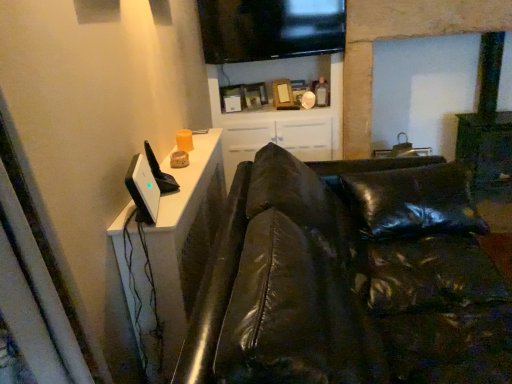
Question: From a real-world perspective, is flat screen tv at upper center physically above white glossy cabinet at upper center?

Choices:
 (A) no
 (B) yes

Answer: (B)

Question: Is flat screen tv at upper center at the left side of white glossy cabinet at upper center?

Choices:
 (A) no
 (B) yes

Answer: (B)

Question: Considering the relative sizes of flat screen tv at upper center and white glossy cabinet at upper center in the image provided, is flat screen tv at upper center thinner than white glossy cabinet at upper center?

Choices:
 (A) no
 (B) yes

Answer: (B)

Question: Is flat screen tv at upper center further to the viewer compared to white glossy cabinet at upper center?

Choices:
 (A) no
 (B) yes

Answer: (A)

Question: Considering the relative sizes of flat screen tv at upper center and white glossy cabinet at upper center in the image provided, is flat screen tv at upper center wider than white glossy cabinet at upper center?

Choices:
 (A) no
 (B) yes

Answer: (A)

Question: Is white glossy cabinet at upper center surrounded by flat screen tv at upper center?

Choices:
 (A) yes
 (B) no

Answer: (B)

Question: From a real-world perspective, is flat screen tv at upper center over black leather couch at left?

Choices:
 (A) yes
 (B) no

Answer: (A)

Question: Considering the relative sizes of flat screen tv at upper center and black leather couch at left in the image provided, is flat screen tv at upper center thinner than black leather couch at left?

Choices:
 (A) yes
 (B) no

Answer: (A)

Question: From the image's perspective, is flat screen tv at upper center above black leather couch at left?

Choices:
 (A) yes
 (B) no

Answer: (A)

Question: Is flat screen tv at upper center facing away from black leather couch at left?

Choices:
 (A) yes
 (B) no

Answer: (B)

Question: Is flat screen tv at upper center not near black leather couch at left?

Choices:
 (A) yes
 (B) no

Answer: (A)

Question: Is flat screen tv at upper center at the left side of black leather couch at left?

Choices:
 (A) no
 (B) yes

Answer: (B)

Question: From the image's perspective, is black leather couch at left over white glossy dresser at upper left?

Choices:
 (A) no
 (B) yes

Answer: (A)